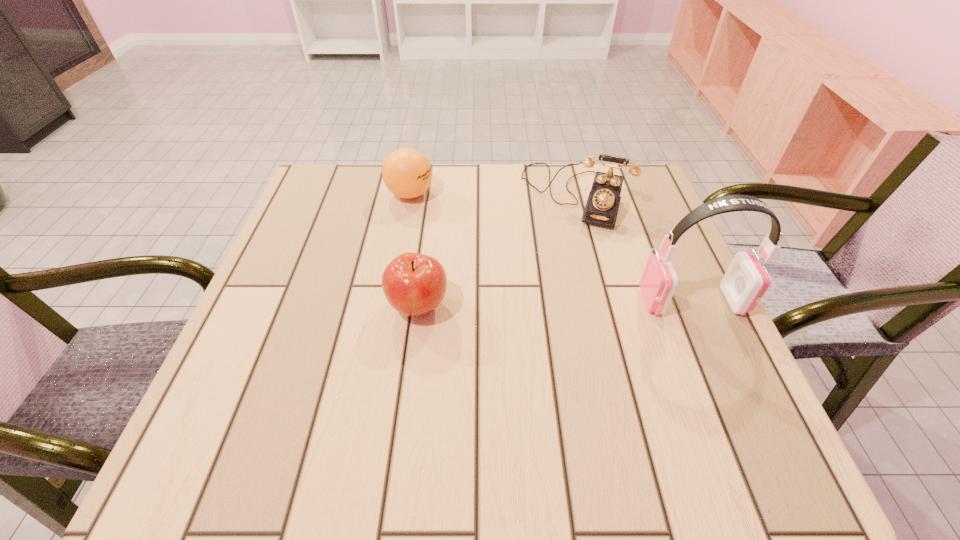
This screenshot has height=540, width=960. Find the location of `free space located on the dial of the telephone`. free space located on the dial of the telephone is located at coordinates (525, 346).

At what (x,y) coordinates should I click in order to perform the action: click on ping-pong ball that is at the far edge. Please return your answer as a coordinate pair (x, y). Looking at the image, I should click on point(407,173).

The height and width of the screenshot is (540, 960). What are the coordinates of `telephone positioned at the far edge` in the screenshot? It's located at (603, 202).

Locate an element on the screen. earphone at the right edge is located at coordinates (745, 283).

Find the location of a particular element. The width and height of the screenshot is (960, 540). telephone that is positioned at the right edge is located at coordinates (603, 202).

Find the location of a particular element. This screenshot has height=540, width=960. object positioned at the far right corner is located at coordinates (603, 202).

In the image, there is a desktop. Where is `vacant space at the far edge`? This screenshot has width=960, height=540. vacant space at the far edge is located at coordinates (557, 165).

Identify the location of vacant region at the left edge. This screenshot has width=960, height=540. (284, 329).

Image resolution: width=960 pixels, height=540 pixels. In order to click on vacant region at the right edge of the desktop in this screenshot , I will do click(685, 279).

Find the location of a particular element. Image resolution: width=960 pixels, height=540 pixels. vacant space at the far right corner of the desktop is located at coordinates (636, 164).